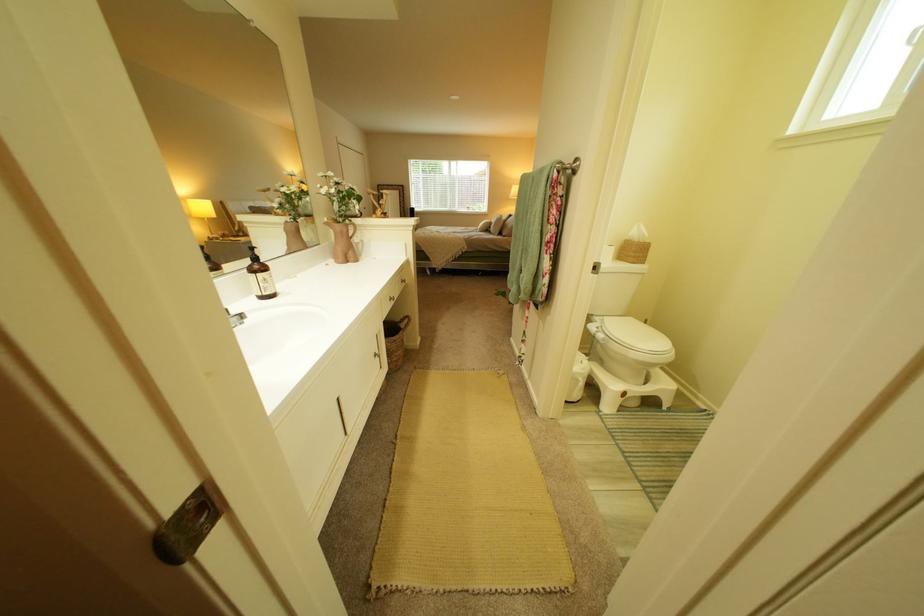
Image resolution: width=924 pixels, height=616 pixels. What are the coordinates of `white step stool` in the screenshot? It's located at (650, 402).